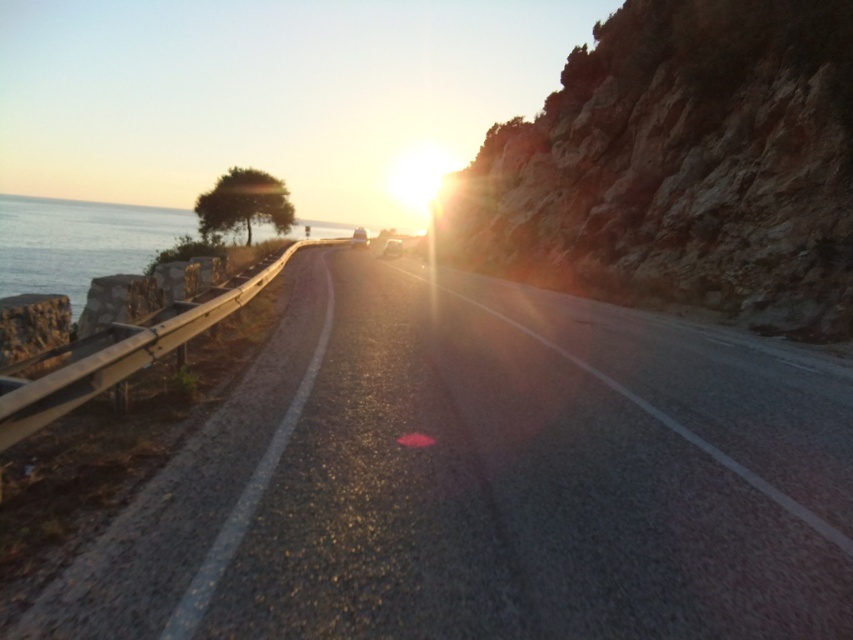
Question: Observing the image, what is the correct spatial positioning of asphalt road at center in reference to blue water at left?

Choices:
 (A) right
 (B) left

Answer: (A)

Question: Which object is farther from the camera taking this photo?

Choices:
 (A) blue water at left
 (B) asphalt road at center
 (C) rocky cliff at right

Answer: (C)

Question: Which of the following is the farthest from the observer?

Choices:
 (A) (447, 236)
 (B) (91, 232)
 (C) (329, 557)

Answer: (B)

Question: Can you confirm if asphalt road at center is positioned to the right of blue water at left?

Choices:
 (A) no
 (B) yes

Answer: (B)

Question: Which object is farther from the camera taking this photo?

Choices:
 (A) blue water at left
 (B) asphalt road at center

Answer: (A)

Question: Can you confirm if asphalt road at center is positioned to the left of rocky cliff at right?

Choices:
 (A) yes
 (B) no

Answer: (A)